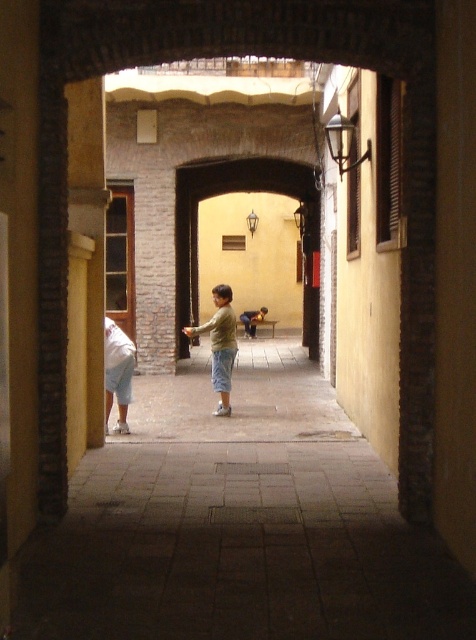
Is point (229, 314) farther from viewer compared to point (128, 428)?

Yes, point (229, 314) is farther from viewer.

Describe the element at coordinates (219, 344) in the screenshot. This screenshot has height=640, width=476. I see `matte green shirt at center` at that location.

Is point (226, 317) in front of point (112, 396)?

No.

Find the location of a particular element. matte green shirt at center is located at coordinates (219, 344).